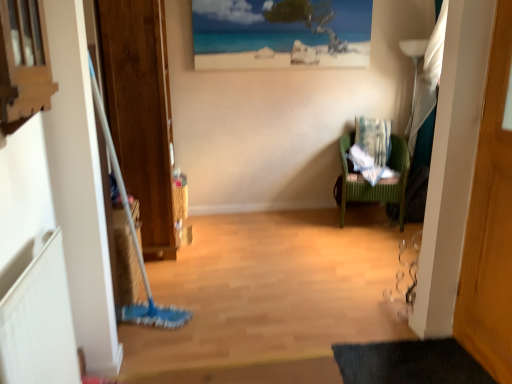
What do you see at coordinates (39, 322) in the screenshot?
I see `white textured radiator at lower left` at bounding box center [39, 322].

What do you see at coordinates (180, 197) in the screenshot?
I see `bamboo picnic basket at center` at bounding box center [180, 197].

Measure the distance between point (368, 118) and camera.

Point (368, 118) and camera are 3.56 meters apart from each other.

The width and height of the screenshot is (512, 384). What do you see at coordinates (280, 33) in the screenshot?
I see `beach scene print at upper center` at bounding box center [280, 33].

Describe the element at coordinates (140, 112) in the screenshot. I see `wooden screen door at left` at that location.

Find the location of a particular element. The width and height of the screenshot is (512, 384). white textured radiator at lower left is located at coordinates (39, 322).

Would you say black rubber bath mat at lower right is a long distance from patterned fabric laundry at right?

Absolutely, black rubber bath mat at lower right is distant from patterned fabric laundry at right.

Is patterned fabric laundry at right at the back of black rubber bath mat at lower right?

black rubber bath mat at lower right does not have its back to patterned fabric laundry at right.

From the picture: Considering the relative positions of black rubber bath mat at lower right and patterned fabric laundry at right in the image provided, is black rubber bath mat at lower right in front of patterned fabric laundry at right?

Yes.

Considering the sizes of black rubber bath mat at lower right and patterned fabric laundry at right in the image, is black rubber bath mat at lower right wider or thinner than patterned fabric laundry at right?

Considering their sizes, black rubber bath mat at lower right looks broader than patterned fabric laundry at right.

Is wooden screen door at left at the right side of patterned fabric laundry at right?

In fact, wooden screen door at left is to the left of patterned fabric laundry at right.

Which is in front, point (130, 47) or point (355, 124)?

The point (130, 47) is more forward.

Does wooden screen door at left turn towards patterned fabric laundry at right?

Yes, wooden screen door at left faces towards patterned fabric laundry at right.

What's the angular difference between wooden screen door at left and patterned fabric laundry at right's facing directions?

114 degrees.

The image size is (512, 384). I want to click on screen door above the wooden frame at upper left (from the image's perspective), so click(x=140, y=112).

From a real-world perspective, relative to wooden screen door at left, is wooden frame at upper left vertically above or below?

From a real-world perspective, wooden frame at upper left is physically above wooden screen door at left.

Is wooden frame at upper left positioned far away from wooden screen door at left?

Yes, wooden frame at upper left and wooden screen door at left are quite far apart.

Does point (2, 55) come closer to viewer compared to point (115, 113)?

Yes, point (2, 55) is in front of point (115, 113).

Is beach scene print at upper center aimed at white textured radiator at lower left?

No, beach scene print at upper center is not turned towards white textured radiator at lower left.

Based on the photo, considering the relative positions of beach scene print at upper center and white textured radiator at lower left in the image provided, is beach scene print at upper center behind white textured radiator at lower left?

Yes, beach scene print at upper center is further from the viewer.

Considering the positions of point (309, 39) and point (48, 376), is point (309, 39) closer or farther from the camera than point (48, 376)?

Clearly, point (309, 39) is more distant from the camera than point (48, 376).

Can you confirm if beach scene print at upper center is taller than white textured radiator at lower left?

In fact, beach scene print at upper center may be shorter than white textured radiator at lower left.

From a real-world perspective, is green plastic chair at right positioned under bamboo picnic basket at center based on gravity?

Incorrect, from a real-world perspective, green plastic chair at right is higher than bamboo picnic basket at center.

Locate an element on the screen. This screenshot has width=512, height=384. picnic basket below the green plastic chair at right (from a real-world perspective) is located at coordinates (180, 197).

Is green plastic chair at right bigger than bamboo picnic basket at center?

Correct, green plastic chair at right is larger in size than bamboo picnic basket at center.

Is point (350, 132) closer to viewer compared to point (180, 182)?

No.

Looking at their sizes, would you say wooden screen door at left is wider or thinner than wooden frame at upper left?

→ Clearly, wooden screen door at left has more width compared to wooden frame at upper left.

Considering the points (164, 107) and (44, 64), which point is in front, point (164, 107) or point (44, 64)?

The point (44, 64) is closer.

What's the angular difference between wooden screen door at left and wooden frame at upper left's facing directions?

1.16 degrees separate the facing orientations of wooden screen door at left and wooden frame at upper left.

Is wooden frame at upper left at the back of wooden screen door at left?

No, wooden screen door at left is not facing the opposite direction of wooden frame at upper left.

Based on the photo, is beach scene print at upper center at the back of wooden door at right?

No, wooden door at right is not facing away from beach scene print at upper center.

Which object is further away from the camera, wooden door at right or beach scene print at upper center?

beach scene print at upper center is further from the camera.

Can we say wooden door at right lies outside beach scene print at upper center?

wooden door at right lies outside beach scene print at upper center's area.

From a real-world perspective, is wooden door at right physically located above or below beach scene print at upper center?

Clearly, from a real-world perspective, wooden door at right is below beach scene print at upper center.

The width and height of the screenshot is (512, 384). Find the location of `bath mat on the left side of patterned fabric laundry at right`. bath mat on the left side of patterned fabric laundry at right is located at coordinates coord(409,363).

This screenshot has height=384, width=512. I want to click on screen door above the patterned fabric laundry at right (from the image's perspective), so click(140, 112).

Looking at this image, when comparing their distances from white textured radiator at lower left, does beach scene print at upper center or bamboo picnic basket at center seem further?

beach scene print at upper center is further to white textured radiator at lower left.

Looking at the image, which one is located closer to beach scene print at upper center, patterned fabric laundry at right or bamboo picnic basket at center?

Among the two, patterned fabric laundry at right is located nearer to beach scene print at upper center.

Considering their positions, is wooden frame at upper left positioned further to black rubber bath mat at lower right than patterned fabric laundry at right?

Among the two, patterned fabric laundry at right is located further to black rubber bath mat at lower right.

In the scene shown: Looking at the image, which one is located further to wooden door at right, beach scene print at upper center or wooden frame at upper left?

beach scene print at upper center lies further to wooden door at right than the other object.

From the image, which object appears to be farther from black rubber bath mat at lower right, green plastic chair at right or wooden screen door at left?

wooden screen door at left.

Considering their positions, is wooden frame at upper left positioned closer to wooden screen door at left than bamboo picnic basket at center?

bamboo picnic basket at center is closer to wooden screen door at left.

Considering their positions, is bamboo picnic basket at center positioned further to patterned fabric laundry at right than wooden frame at upper left?

The object further to patterned fabric laundry at right is wooden frame at upper left.

From the image, which object appears to be nearer to black rubber bath mat at lower right, white textured radiator at lower left or bamboo picnic basket at center?

Among the two, white textured radiator at lower left is located nearer to black rubber bath mat at lower right.

In order to click on picnic basket located between wooden door at right and patterned fabric laundry at right in the depth direction in this screenshot , I will do `click(180, 197)`.

Find the location of a particular element. This screenshot has width=512, height=384. bath mat between wooden screen door at left and patterned fabric laundry at right is located at coordinates (409, 363).

You are a GUI agent. You are given a task and a screenshot of the screen. Output one action in this format:
    pyautogui.click(x=<x>, y=<y>)
    Task: Click on the chair located between bamboo picnic basket at center and patterned fabric laundry at right in the left-right direction
    Image resolution: width=512 pixels, height=384 pixels.
    Given the screenshot: What is the action you would take?
    pyautogui.click(x=378, y=183)

Locate an element on the screen. Image resolution: width=512 pixels, height=384 pixels. radiator located between wooden frame at upper left and beach scene print at upper center in the depth direction is located at coordinates (39, 322).